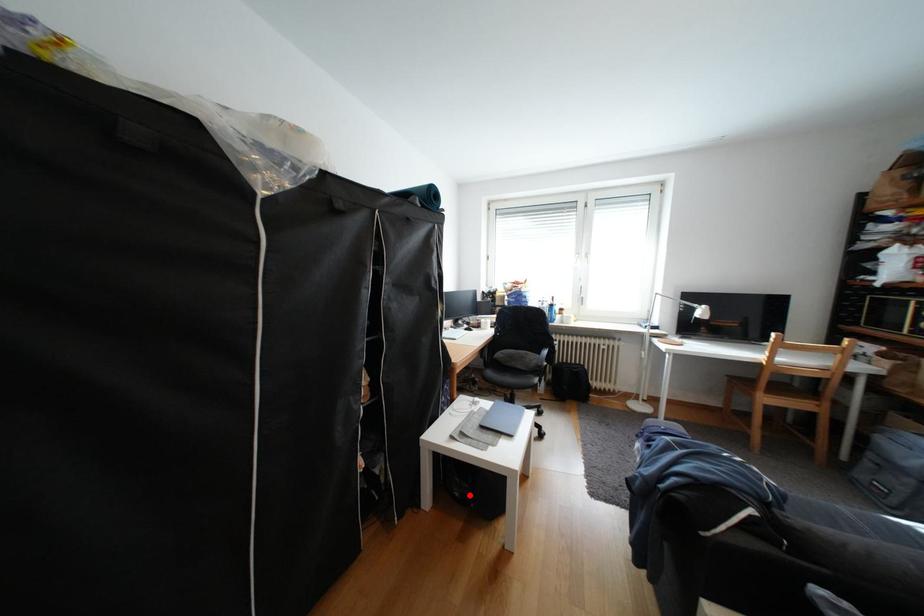
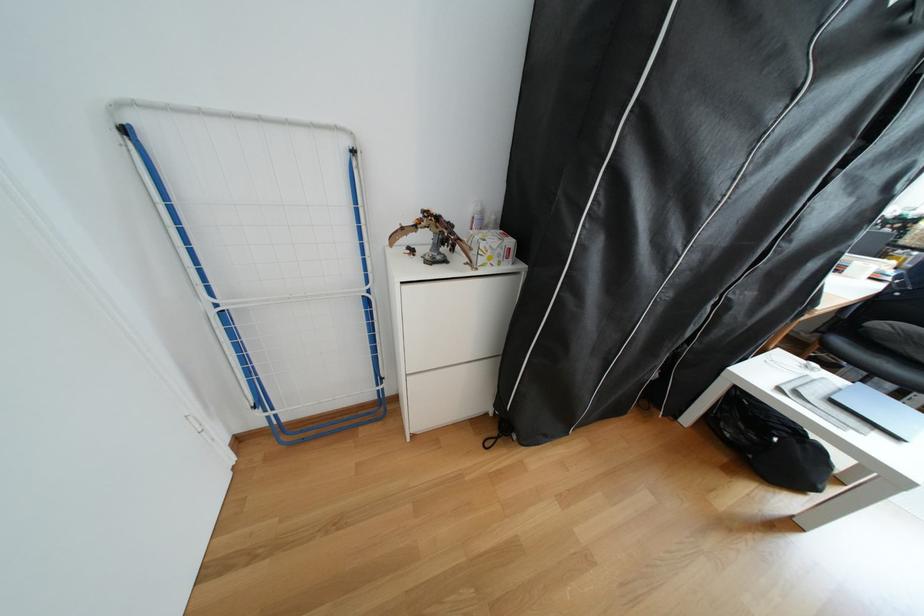
Where in the second image is the point corresponding to the highlighted location from the first image?

(739, 436)